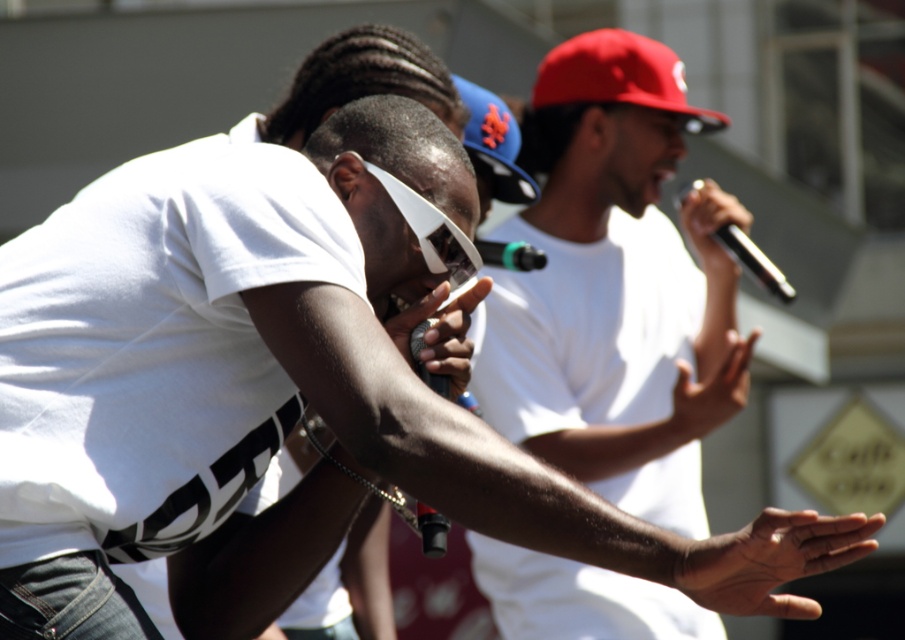
You are a photographer trying to capture a closeup of the blue fabric baseball cap at center and the black metallic microphone at upper right in the scene. Since you want both items to appear similarly sized in the photo, which object should you move closer to the camera?

The blue fabric baseball cap at center is bigger than the black metallic microphone at upper right, so to make them appear similarly sized in the photo, you should move the black metallic microphone at upper right closer to the camera.

You are a photographer standing at the origin point of the coordinate system. The scene has a blue fabric baseball cap at center. Can you confirm if the point you are focusing on, point (494,141), corresponds to the blue fabric baseball cap at center?

Yes, the blue fabric baseball cap at center is represented by point (494,141), so the point you are focusing on does correspond to the blue fabric baseball cap at center.

You are a photographer at the event and need to capture a photo that includes both the blue fabric baseball cap at center and the black metallic microphone at upper right. Based on their positions, which object should you focus on first to ensure both are in frame?

The blue fabric baseball cap at center is located above the black metallic microphone at upper right, so you should focus on the blue fabric baseball cap at center first to ensure both are in frame.